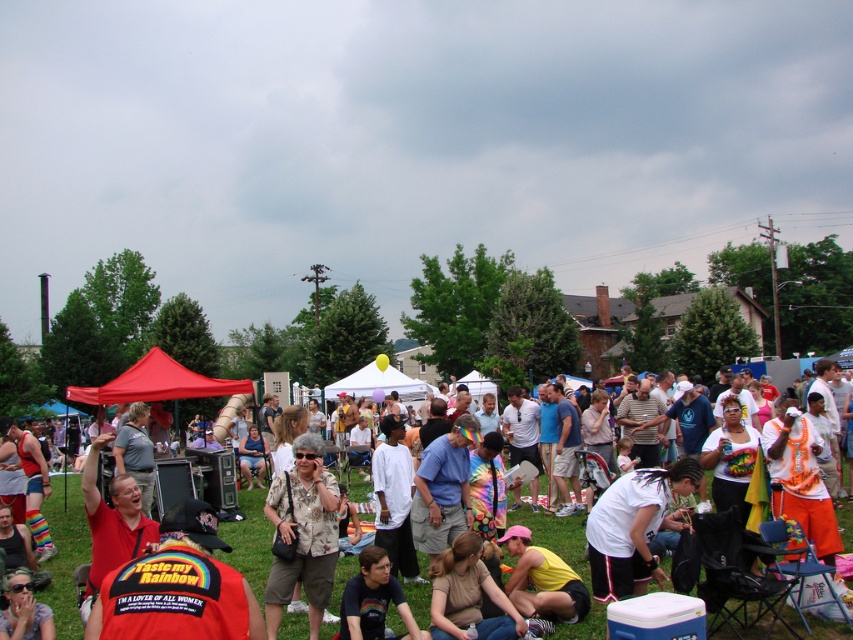
Question: Does red fabric shirt at center appear on the left side of rainbow t-shirt at center?

Choices:
 (A) no
 (B) yes

Answer: (B)

Question: Among these objects, which one is nearest to the camera?

Choices:
 (A) red fabric shirt at center
 (B) yellow matte shirt at center
 (C) matte pink shirt at center

Answer: (A)

Question: Can you confirm if matte black t-shirt at center is thinner than rainbow t-shirt at center?

Choices:
 (A) no
 (B) yes

Answer: (A)

Question: Which object appears farthest from the camera in this image?

Choices:
 (A) rainbow t-shirt at center
 (B) red fabric shirt at center

Answer: (B)

Question: Estimate the real-world distances between objects in this image. Which object is farther from the red fabric shirt at center?

Choices:
 (A) white matte shirt at center
 (B) printed fabric shirt at center
 (C) matte black t-shirt at center

Answer: (C)

Question: Does matte pink shirt at center have a lesser width compared to rainbow t-shirt at center?

Choices:
 (A) no
 (B) yes

Answer: (A)